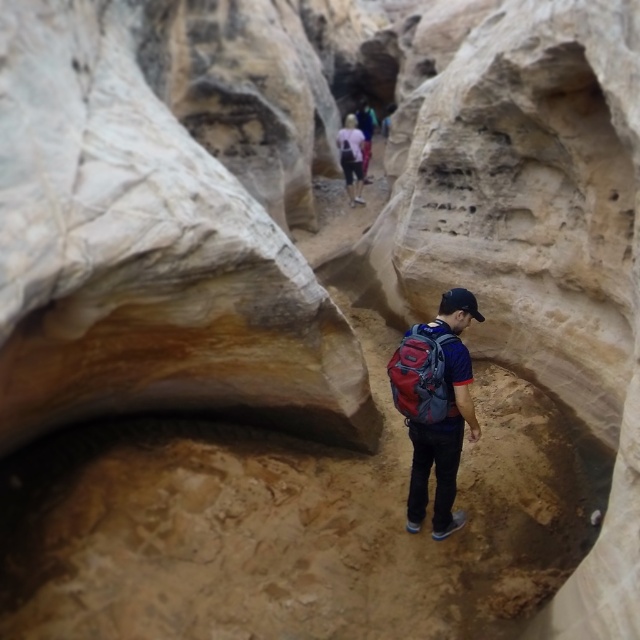
Question: Which object is farther from the camera taking this photo?

Choices:
 (A) pink fabric shirt at upper center
 (B) red fabric backpack at center
 (C) matte blue backpack at center

Answer: (A)

Question: Is red fabric backpack at center above pink fabric shirt at upper center?

Choices:
 (A) yes
 (B) no

Answer: (B)

Question: Does matte blue backpack at center lie behind red fabric backpack at center?

Choices:
 (A) no
 (B) yes

Answer: (B)

Question: Is red fabric backpack at center thinner than pink fabric shirt at upper center?

Choices:
 (A) yes
 (B) no

Answer: (A)

Question: Based on their relative distances, which object is nearer to the red fabric backpack at center?

Choices:
 (A) matte blue backpack at center
 (B) pink fabric shirt at upper center

Answer: (A)

Question: Which point is closer to the camera?

Choices:
 (A) (410, 381)
 (B) (360, 144)
 (C) (474, 298)

Answer: (A)